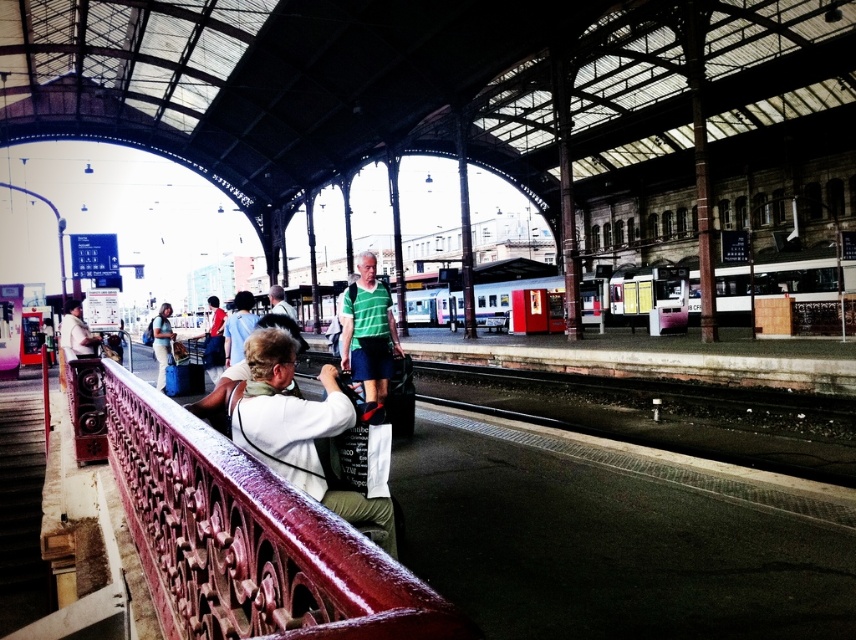
Based on the photo, who is higher up, white fabric camera at center or green fabric shirt at center?

Positioned higher is green fabric shirt at center.

Does white fabric camera at center appear on the right side of green fabric shirt at center?

Yes, white fabric camera at center is to the right of green fabric shirt at center.

Image resolution: width=856 pixels, height=640 pixels. Describe the element at coordinates (301, 429) in the screenshot. I see `white fabric camera at center` at that location.

Find the location of a particular element. The width and height of the screenshot is (856, 640). white fabric camera at center is located at coordinates (301, 429).

Is polished metal railing at lower left to the left of white fabric camera at center from the viewer's perspective?

Correct, you'll find polished metal railing at lower left to the left of white fabric camera at center.

Describe the element at coordinates (250, 540) in the screenshot. I see `polished metal railing at lower left` at that location.

Between point (293, 577) and point (324, 448), which one is positioned in front?

Point (293, 577)

In order to click on polished metal railing at lower left in this screenshot , I will do `click(250, 540)`.

Between green matte shorts at center and matte white shirt at left, which one has less height?

matte white shirt at left is shorter.

Is green matte shorts at center further to camera compared to matte white shirt at left?

No, green matte shorts at center is closer to the viewer.

Which is behind, point (345, 369) or point (68, 342)?

Point (68, 342)

Locate an element on the screen. The image size is (856, 640). green matte shorts at center is located at coordinates (369, 337).